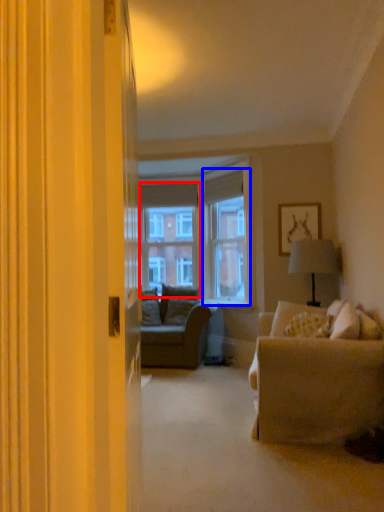
Question: Which of the following is the farthest to the observer, window screen (highlighted by a red box) or window screen (highlighted by a blue box)?

Choices:
 (A) window screen
 (B) window screen

Answer: (A)